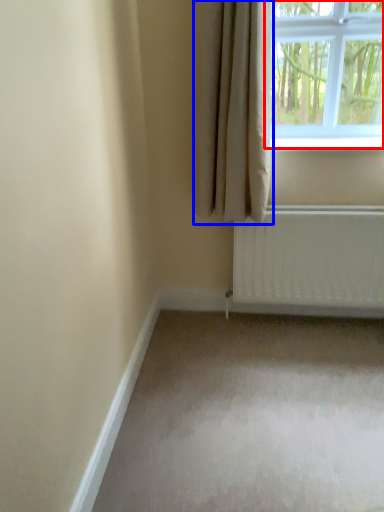
Question: Which point is further to the camera, window (highlighted by a red box) or curtain (highlighted by a blue box)?

Choices:
 (A) window
 (B) curtain

Answer: (A)